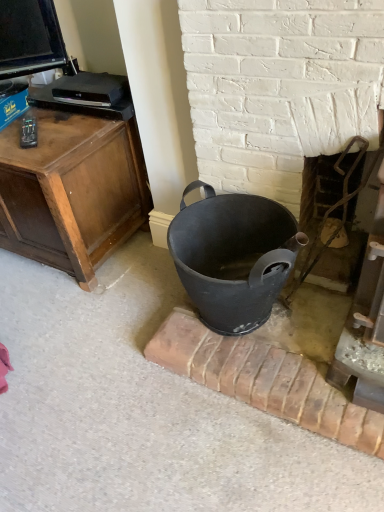
This screenshot has width=384, height=512. In order to click on vacant area that is in front of rustic metal fireplace at right, acting as the first fireplace starting from the right in this screenshot , I will do `click(317, 341)`.